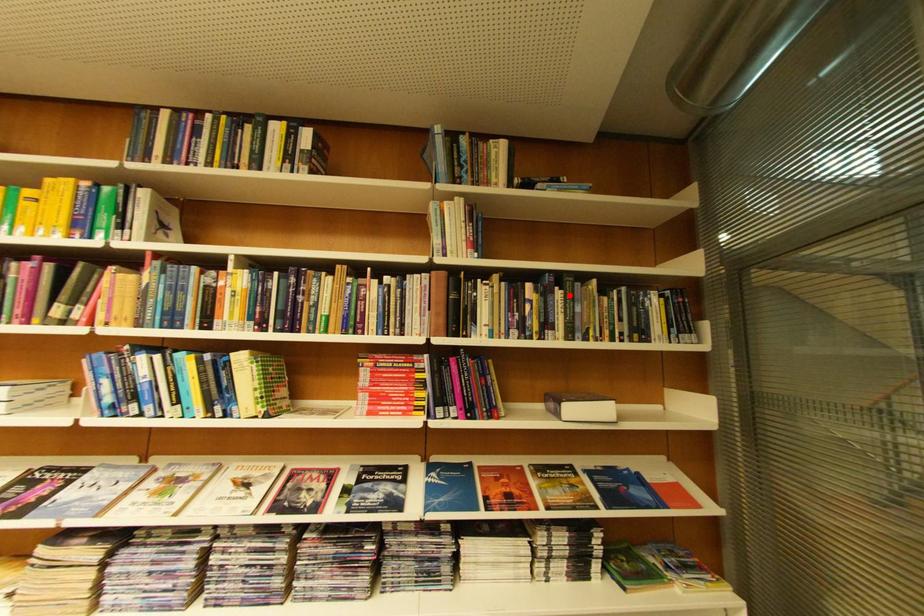
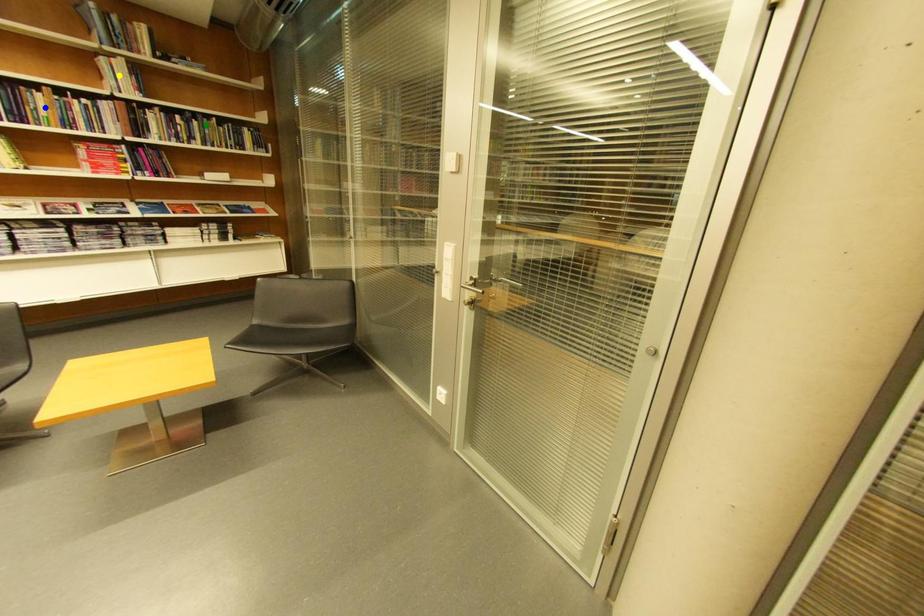
Question: I am providing you with two images of the same scene from different viewpoints. A red point is marked on the first image. You are given multiple points on the second image. Which mark in image 2 goes with the point in image 1?

Choices:
 (A) blue point
 (B) yellow point
 (C) green point

Answer: (C)